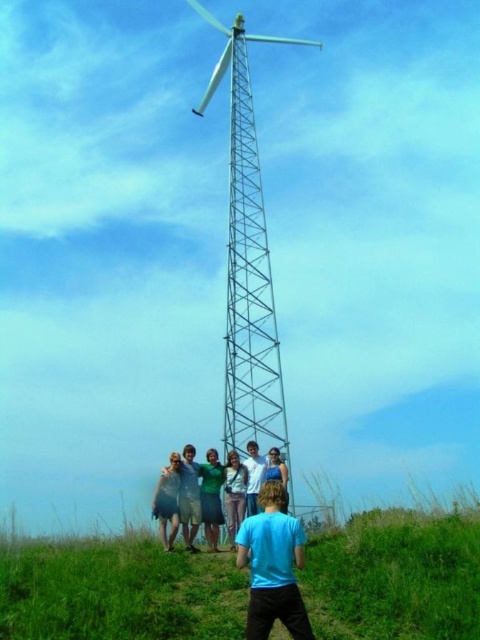
You are standing in the open grassy field and want to take a photo of the group. You see the green grassy hillside at lower center and the light blue shirt at lower center. Which object is closer to you?

The green grassy hillside at lower center is closer to you because it is in front of the light blue shirt at lower center.

You are standing in the field and want to place a small flag at each of the two points, point (87, 604) and point (224, 417). Which point will have its flag appear closer to you when viewed from your current position?

Point (87, 604) is closer to the viewer than point (224, 417), so the flag placed at point (87, 604) will appear closer.